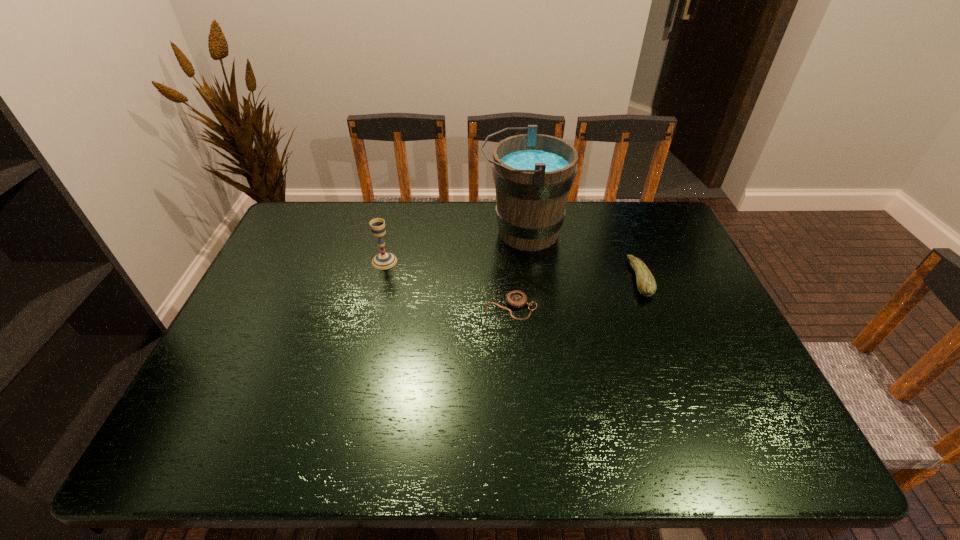
You are a GUI agent. You are given a task and a screenshot of the screen. Output one action in this format:
    pyautogui.click(x=<x>, y=<y>)
    Task: Click on the vacant space positioned at the stem end of the second shortest object
    
    Given the screenshot: What is the action you would take?
    pyautogui.click(x=575, y=279)

Image resolution: width=960 pixels, height=540 pixels. Identify the location of vacant point located 0.390m at the stem end of the second shortest object. (496, 279).

The height and width of the screenshot is (540, 960). What are the coordinates of `free spot located at the stem end of the second shortest object` in the screenshot? It's located at (592, 279).

Where is `vacant space located 0.340m on the back of the shortest object`? vacant space located 0.340m on the back of the shortest object is located at coordinates (505, 222).

The image size is (960, 540). In order to click on object present at the far edge in this screenshot , I will do click(x=533, y=173).

Locate an element on the screen. This screenshot has width=960, height=540. object located at the right edge is located at coordinates (646, 284).

The image size is (960, 540). I want to click on free location at the far edge, so click(x=370, y=208).

In the image, there is a desktop. Where is `vacant space at the near edge`? This screenshot has height=540, width=960. vacant space at the near edge is located at coordinates (450, 437).

The height and width of the screenshot is (540, 960). In order to click on free space at the left edge in this screenshot , I will do `click(264, 280)`.

The image size is (960, 540). In the image, there is a desktop. In order to click on vacant space at the right edge in this screenshot , I will do click(x=741, y=386).